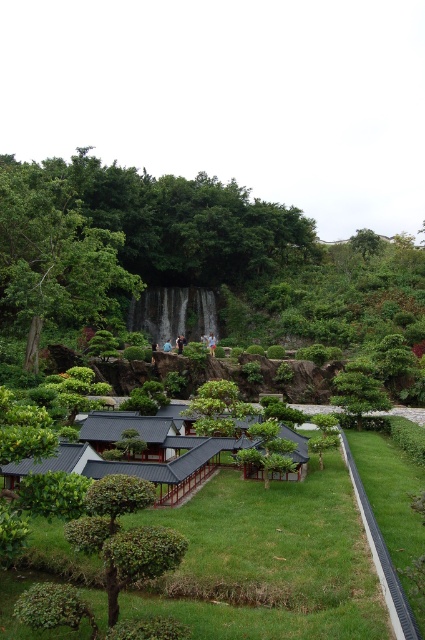
Question: Does green leafy tree at left appear on the right side of green leafy tree at upper center?

Choices:
 (A) no
 (B) yes

Answer: (A)

Question: Is green leafy tree at left below green leafy tree at upper center?

Choices:
 (A) no
 (B) yes

Answer: (B)

Question: Is green leafy tree at left below green leafy tree at upper center?

Choices:
 (A) yes
 (B) no

Answer: (A)

Question: Among these objects, which one is nearest to the camera?

Choices:
 (A) green leafy tree at upper center
 (B) green leafy tree at left

Answer: (B)

Question: Among these objects, which one is farthest from the camera?

Choices:
 (A) green leafy tree at left
 (B) green leafy tree at upper center

Answer: (B)